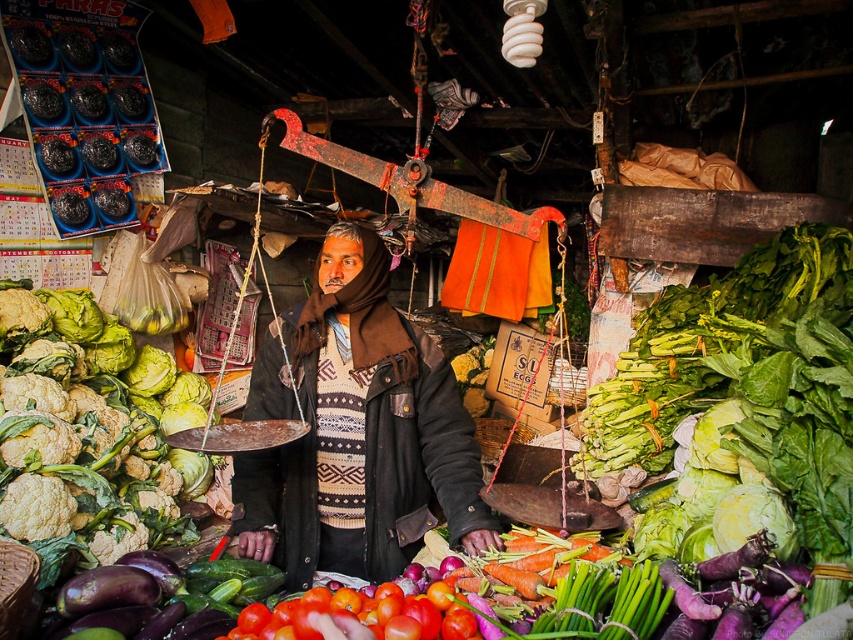
Does point (305, 512) come closer to viewer compared to point (769, 531)?

No, it is not.

Who is more forward, (444, 481) or (740, 486)?

Point (740, 486) is more forward.

Who is more distant from viewer, (345, 420) or (734, 531)?

The point (345, 420) is behind.

Image resolution: width=853 pixels, height=640 pixels. What are the coordinates of `brown woolen scarf at center` in the screenshot? It's located at (355, 432).

Is point (26, 412) closer to viewer compared to point (281, 604)?

No.

Does green leafy cauliflower at left have a larger size compared to shiny red tomatoes at center?

Correct, green leafy cauliflower at left is larger in size than shiny red tomatoes at center.

Who is more distant from viewer, (12, 528) or (297, 636)?

The point (12, 528) is behind.

At what (x,y) coordinates should I click in order to perform the action: click on green leafy cauliflower at left. Please return your answer as a coordinate pair (x, y). Looking at the image, I should click on (90, 458).

Does brown woolen scarf at center have a lesser width compared to green leafy cauliflower at left?

No, brown woolen scarf at center is not thinner than green leafy cauliflower at left.

The image size is (853, 640). What do you see at coordinates (355, 432) in the screenshot?
I see `brown woolen scarf at center` at bounding box center [355, 432].

The height and width of the screenshot is (640, 853). In order to click on brown woolen scarf at center in this screenshot , I will do `click(355, 432)`.